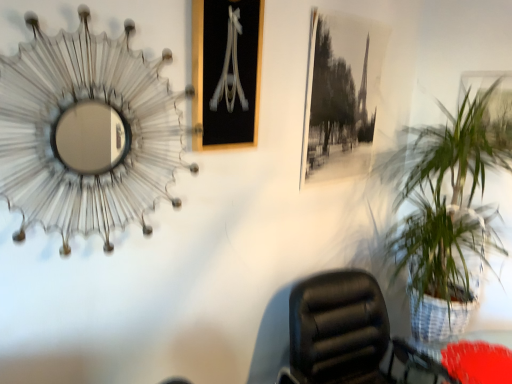
Question: Is black paper picture frame at upper center, which ranks as the 2th picture frame in left-to-right order, positioned behind black glass picture frame at upper center, the 1th picture frame viewed from the left?

Choices:
 (A) yes
 (B) no

Answer: (A)

Question: Is black paper picture frame at upper center, arranged as the 2th picture frame when viewed from the right, to the right of black glass picture frame at upper center, which ranks as the third picture frame in right-to-left order, from the viewer's perspective?

Choices:
 (A) yes
 (B) no

Answer: (A)

Question: From a real-world perspective, does black paper picture frame at upper center, which ranks as the 2th picture frame in left-to-right order, stand above black glass picture frame at upper center, the 1th picture frame viewed from the left?

Choices:
 (A) no
 (B) yes

Answer: (A)

Question: Considering the relative sizes of black paper picture frame at upper center, which ranks as the 2th picture frame in left-to-right order, and black glass picture frame at upper center, the 1th picture frame viewed from the left, in the image provided, is black paper picture frame at upper center, which ranks as the 2th picture frame in left-to-right order, smaller than black glass picture frame at upper center, the 1th picture frame viewed from the left,?

Choices:
 (A) yes
 (B) no

Answer: (B)

Question: Is black glass picture frame at upper center, which ranks as the third picture frame in right-to-left order, surrounded by black paper picture frame at upper center, arranged as the 2th picture frame when viewed from the right?

Choices:
 (A) no
 (B) yes

Answer: (A)

Question: Would you say black paper picture frame at upper center, arranged as the 2th picture frame when viewed from the right, is a long distance from black glass picture frame at upper center, the 1th picture frame viewed from the left?

Choices:
 (A) yes
 (B) no

Answer: (B)

Question: From a real-world perspective, is metallic wireframe mirror at upper left positioned under metallic silver picture frame at upper right, marked as the third picture frame in a left-to-right arrangement, based on gravity?

Choices:
 (A) yes
 (B) no

Answer: (A)

Question: Is the surface of metallic wireframe mirror at upper left in direct contact with metallic silver picture frame at upper right, marked as the third picture frame in a left-to-right arrangement?

Choices:
 (A) yes
 (B) no

Answer: (B)

Question: Is metallic wireframe mirror at upper left aimed at metallic silver picture frame at upper right, positioned as the 1th picture frame in right-to-left order?

Choices:
 (A) yes
 (B) no

Answer: (B)

Question: Is metallic wireframe mirror at upper left to the right of metallic silver picture frame at upper right, marked as the third picture frame in a left-to-right arrangement, from the viewer's perspective?

Choices:
 (A) no
 (B) yes

Answer: (A)

Question: Is metallic wireframe mirror at upper left outside of metallic silver picture frame at upper right, marked as the third picture frame in a left-to-right arrangement?

Choices:
 (A) no
 (B) yes

Answer: (B)

Question: Does metallic wireframe mirror at upper left have a greater width compared to metallic silver picture frame at upper right, marked as the third picture frame in a left-to-right arrangement?

Choices:
 (A) yes
 (B) no

Answer: (A)

Question: From a real-world perspective, is black leather chair at lower right physically below metallic silver picture frame at upper right, marked as the third picture frame in a left-to-right arrangement?

Choices:
 (A) no
 (B) yes

Answer: (B)